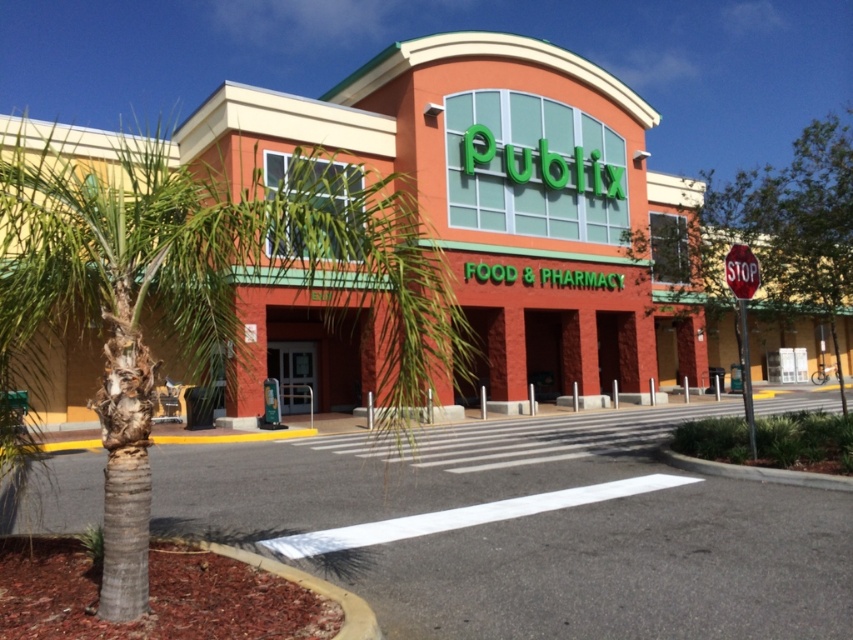
Question: Considering the real-world distances, which object is closest to the green leafy palm tree at center?

Choices:
 (A) red glossy stop sign at upper right
 (B) matte brick building at center

Answer: (B)

Question: Which point is closer to the camera?

Choices:
 (A) (689, 369)
 (B) (741, 250)
 (C) (115, 468)

Answer: (C)

Question: Which object is positioned farthest from the matte brick building at center?

Choices:
 (A) green leafy palm tree at center
 (B) red glossy stop sign at upper right

Answer: (B)

Question: In this image, where is matte brick building at center located relative to red glossy stop sign at upper right?

Choices:
 (A) left
 (B) right

Answer: (A)

Question: Does matte brick building at center have a smaller size compared to red glossy stop sign at upper right?

Choices:
 (A) yes
 (B) no

Answer: (B)

Question: Is matte brick building at center positioned at the back of red glossy stop sign at upper right?

Choices:
 (A) yes
 (B) no

Answer: (B)